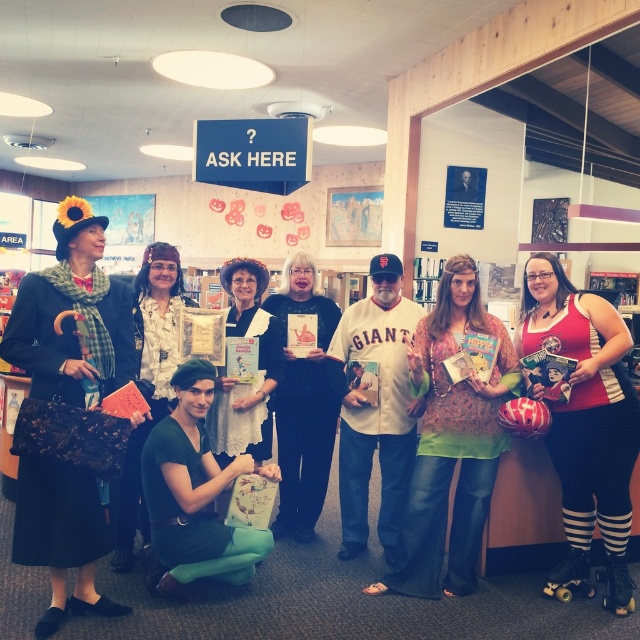
Question: Which object appears closest to the camera in this image?

Choices:
 (A) red and white striped leggings at center
 (B) green fabric dress at center
 (C) matte black dress at center

Answer: (B)

Question: Among these points, which one is farthest from the camera?

Choices:
 (A) (371, 419)
 (B) (563, 272)
 (C) (67, 522)
 (D) (141, 483)

Answer: (B)

Question: Can you confirm if red and white striped leggings at center is wider than white jersey at center?

Choices:
 (A) no
 (B) yes

Answer: (A)

Question: Estimate the real-world distances between objects in this image. Which object is farther from the matte black coat at left?

Choices:
 (A) red and white striped leggings at center
 (B) matte black dress at center

Answer: (A)

Question: Does matte black coat at left have a larger size compared to matte black dress at center?

Choices:
 (A) no
 (B) yes

Answer: (A)

Question: Is red and white striped leggings at center closer to the viewer compared to green fabric dress at center?

Choices:
 (A) no
 (B) yes

Answer: (A)